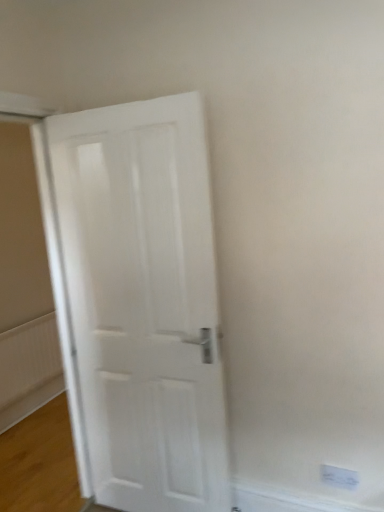
This screenshot has width=384, height=512. I want to click on white textured radiator at lower left, so click(28, 358).

In terms of width, does white matte door at center look wider or thinner when compared to white textured radiator at lower left?

In the image, white matte door at center appears to be wider than white textured radiator at lower left.

Considering the relative sizes of white matte door at center and white textured radiator at lower left in the image provided, is white matte door at center shorter than white textured radiator at lower left?

No.

Does white matte door at center turn towards white textured radiator at lower left?

No, white matte door at center is not oriented towards white textured radiator at lower left.

From a real-world perspective, between white matte door at center and white textured radiator at lower left, who is vertically higher?

white matte door at center is physically above.

Can you confirm if white plastic electric outlet at lower right is positioned to the right of white matte door at center?

Yes.

Can you confirm if white plastic electric outlet at lower right is shorter than white matte door at center?

Yes, white plastic electric outlet at lower right is shorter than white matte door at center.

From the image's perspective, is white plastic electric outlet at lower right over white matte door at center?

No, from the image's perspective, white plastic electric outlet at lower right is not over white matte door at center.

Considering the sizes of objects white matte door at center and white plastic electric outlet at lower right in the image provided, who is shorter, white matte door at center or white plastic electric outlet at lower right?

With less height is white plastic electric outlet at lower right.

Who is more distant, white matte door at center or white plastic electric outlet at lower right?

white plastic electric outlet at lower right is further away from the camera.

From the image's perspective, between white matte door at center and white plastic electric outlet at lower right, who is located below?

From the image's view, white plastic electric outlet at lower right is below.

How much distance is there between white plastic electric outlet at lower right and white textured radiator at lower left?

white plastic electric outlet at lower right is 2.30 meters away from white textured radiator at lower left.

Is white plastic electric outlet at lower right not near white textured radiator at lower left?

Absolutely, white plastic electric outlet at lower right is distant from white textured radiator at lower left.

From their relative heights in the image, would you say white plastic electric outlet at lower right is taller or shorter than white textured radiator at lower left?

Considering their sizes, white plastic electric outlet at lower right has less height than white textured radiator at lower left.

Which object is positioned more to the right, white plastic electric outlet at lower right or white textured radiator at lower left?

white plastic electric outlet at lower right.

Considering the positions of objects white textured radiator at lower left and white plastic electric outlet at lower right in the image provided, who is more to the right, white textured radiator at lower left or white plastic electric outlet at lower right?

Positioned to the right is white plastic electric outlet at lower right.

Locate an element on the screen. electric outlet in front of the white textured radiator at lower left is located at coordinates (339, 477).

Is point (38, 332) closer or farther from the camera than point (337, 486)?

Point (38, 332) appears to be farther away from the viewer than point (337, 486).

Consider the image. Would you say white plastic electric outlet at lower right is part of white textured radiator at lower left's contents?

Actually, white plastic electric outlet at lower right is outside white textured radiator at lower left.

From the image's perspective, is white textured radiator at lower left located above or below white matte door at center?

From the image's perspective, white textured radiator at lower left appears below white matte door at center.

Is white textured radiator at lower left outside of white matte door at center?

white textured radiator at lower left is positioned outside white matte door at center.

Is white textured radiator at lower left in front of or behind white matte door at center in the image?

white textured radiator at lower left is positioned farther from the viewer than white matte door at center.

In order to click on door that appears above the white textured radiator at lower left (from a real-world perspective) in this screenshot , I will do `click(144, 301)`.

The height and width of the screenshot is (512, 384). Find the location of `electric outlet below the white matte door at center (from the image's perspective)`. electric outlet below the white matte door at center (from the image's perspective) is located at coordinates (339, 477).

When comparing their distances from white matte door at center, does white plastic electric outlet at lower right or white textured radiator at lower left seem closer?

white plastic electric outlet at lower right is positioned closer to the anchor white matte door at center.

From the image, which object appears to be nearer to white plastic electric outlet at lower right, white matte door at center or white textured radiator at lower left?

white matte door at center is positioned closer to the anchor white plastic electric outlet at lower right.

Which object lies further to the anchor point white textured radiator at lower left, white plastic electric outlet at lower right or white matte door at center?

Based on the image, white plastic electric outlet at lower right appears to be further to white textured radiator at lower left.

From the image, which object appears to be nearer to white plastic electric outlet at lower right, white textured radiator at lower left or white matte door at center?

white matte door at center is positioned closer to the anchor white plastic electric outlet at lower right.

Based on their spatial positions, is white textured radiator at lower left or white plastic electric outlet at lower right further from white matte door at center?

Among the two, white textured radiator at lower left is located further to white matte door at center.

Estimate the real-world distances between objects in this image. Which object is further from white textured radiator at lower left, white matte door at center or white plastic electric outlet at lower right?

white plastic electric outlet at lower right lies further to white textured radiator at lower left than the other object.

Identify the location of door located between white textured radiator at lower left and white plastic electric outlet at lower right in the left-right direction. The width and height of the screenshot is (384, 512). (144, 301).